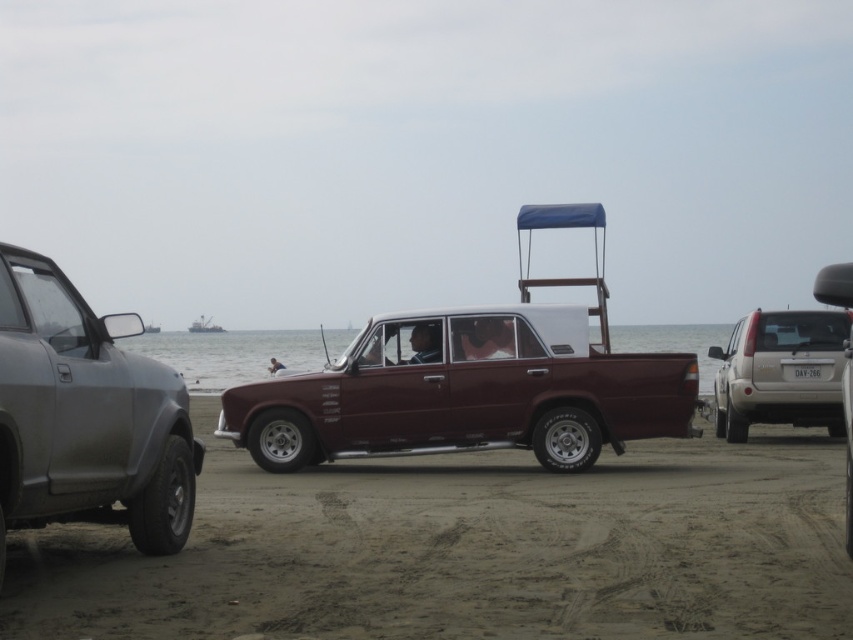
Question: Based on their relative distances, which object is nearer to the sandy brown beach at center?

Choices:
 (A) silver metallic suv at right
 (B) metallic gray boat at left

Answer: (A)

Question: Considering the real-world distances, which object is closest to the metallic gray boat at center?

Choices:
 (A) silver metallic suv at right
 (B) matte gray suv at left

Answer: (A)

Question: Which point is farther to the camera?

Choices:
 (A) (148, 332)
 (B) (189, 324)
 (C) (53, 282)

Answer: (B)

Question: Can you confirm if sandy brown beach at center is wider than silver metallic suv at right?

Choices:
 (A) no
 (B) yes

Answer: (B)

Question: Does sandy brown beach at center appear over matte gray suv at left?

Choices:
 (A) no
 (B) yes

Answer: (A)

Question: Is sandy brown beach at center bigger than matte gray suv at left?

Choices:
 (A) no
 (B) yes

Answer: (B)